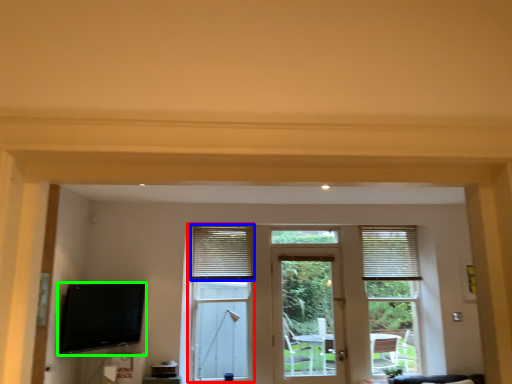
Question: Which is nearer to the bay window (highlighted by a red box)? window blind (highlighted by a blue box) or television (highlighted by a green box).

Choices:
 (A) window blind
 (B) television

Answer: (A)